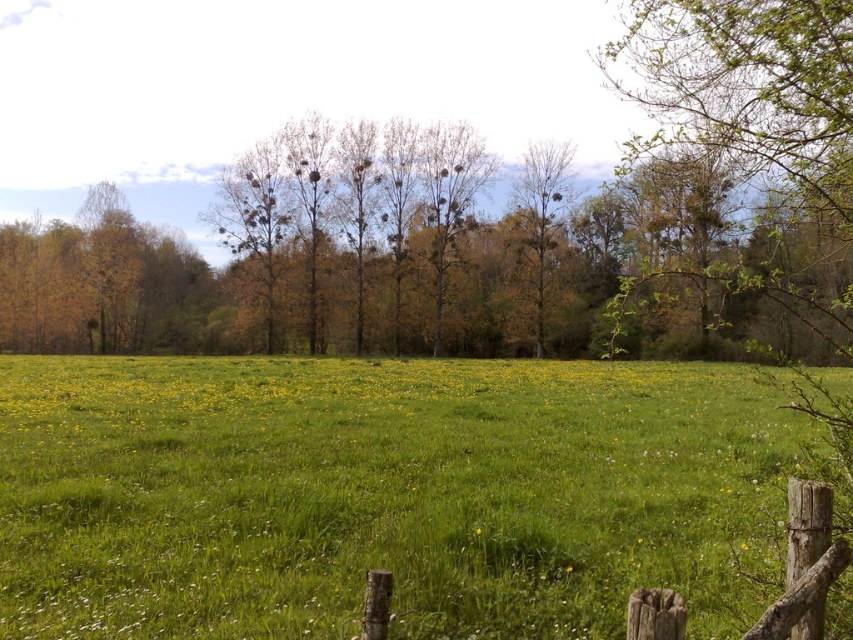
Measure the distance between point (825,506) and camera.

They are 12.28 feet apart.

Which is in front, point (639, 620) or point (532, 310)?

Positioned in front is point (639, 620).

Locate an element on the screen. Image resolution: width=853 pixels, height=640 pixels. wooden post at lower right is located at coordinates tap(804, 564).

Is green grassy pasture at center above green leafy tree at center?

Actually, green grassy pasture at center is below green leafy tree at center.

Who is more distant from viewer, (x=721, y=544) or (x=550, y=140)?

Positioned behind is point (x=550, y=140).

This screenshot has width=853, height=640. In order to click on green grassy pasture at center in this screenshot , I will do `click(379, 493)`.

Is green grassy pasture at center in front of wooden post at lower right?

No, it is not.

Consider the image. Between green grassy pasture at center and wooden post at lower right, which one appears on the right side from the viewer's perspective?

wooden post at lower right

Which is in front, point (119, 387) or point (640, 595)?

Positioned in front is point (640, 595).

Find the location of a particular element. green grassy pasture at center is located at coordinates (379, 493).